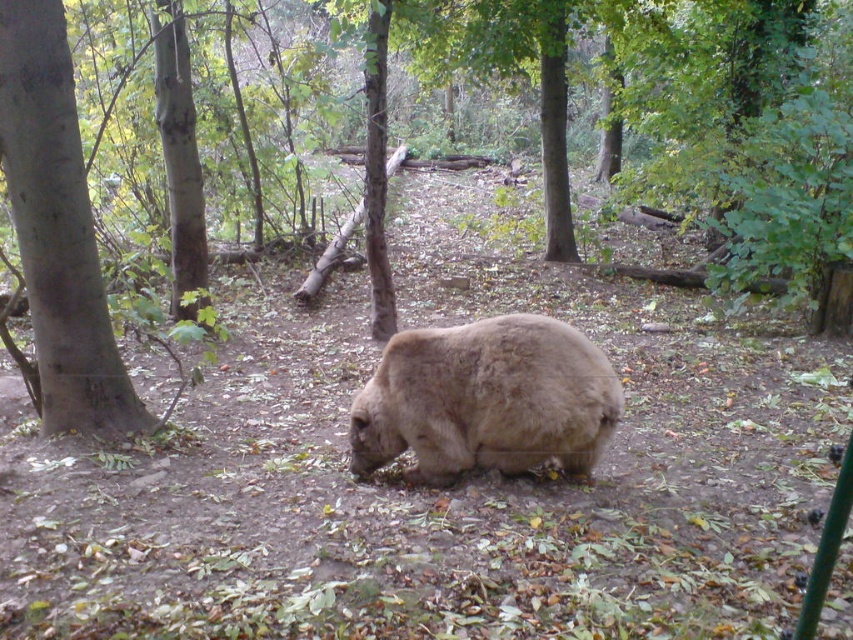
Is fuzzy brown bear at center closer to camera compared to brown furry bear at center?

Yes.

Does fuzzy brown bear at center have a greater height compared to brown furry bear at center?

Yes, fuzzy brown bear at center is taller than brown furry bear at center.

At what (x,y) coordinates should I click in order to perform the action: click on fuzzy brown bear at center. Please return your answer as a coordinate pair (x, y). The height and width of the screenshot is (640, 853). Looking at the image, I should click on (486, 400).

Does fuzzy brown bear at center have a greater height compared to brown rough tree at left?

In fact, fuzzy brown bear at center may be shorter than brown rough tree at left.

Does point (576, 387) come farther from viewer compared to point (45, 24)?

No, (576, 387) is in front of (45, 24).

The height and width of the screenshot is (640, 853). Find the location of `fuzzy brown bear at center`. fuzzy brown bear at center is located at coordinates (486, 400).

Is point (50, 269) behind point (549, 227)?

No.

Between brown rough tree at left and brown furry bear at center, which one is positioned higher?

brown furry bear at center is above.

Does point (6, 99) lie behind point (189, 252)?

No, (6, 99) is closer to viewer.

The image size is (853, 640). In order to click on brown rough tree at left in this screenshot , I will do `click(57, 230)`.